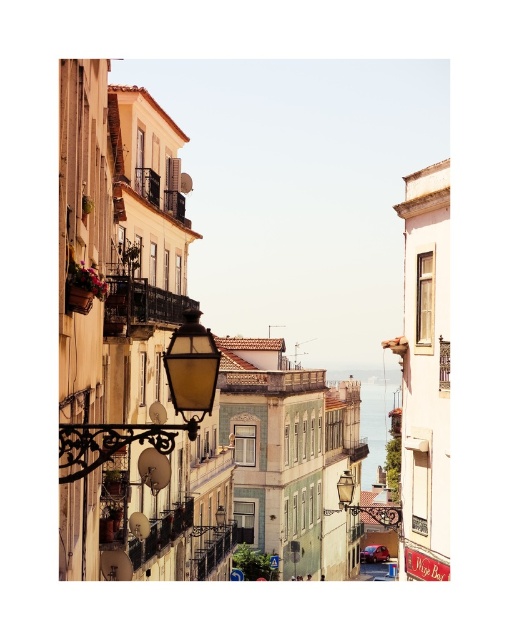
Is matte brass streetlamp at center-left behind clear blue water at center?

That is False.

Who is higher up, matte brass streetlamp at center-left or clear blue water at center?

matte brass streetlamp at center-left is higher up.

Is point (212, 374) positioned in front of point (388, 401)?

Yes, it is in front of point (388, 401).

The image size is (509, 640). What are the coordinates of `matte brass streetlamp at center-left` in the screenshot? It's located at (152, 419).

Is clear blue water at center to the left of matte black streetlamp at center from the viewer's perspective?

In fact, clear blue water at center is to the right of matte black streetlamp at center.

Can you confirm if clear blue water at center is positioned below matte black streetlamp at center?

Yes, clear blue water at center is below matte black streetlamp at center.

Is point (365, 474) positioned before point (379, 547)?

No, it is behind (379, 547).

Identify the location of clear blue water at center. (377, 419).

In the scene shown: Which of these two, matte brass streetlamp at center-left or rustic wrought iron balcony at center-left, stands shorter?

Standing shorter between the two is rustic wrought iron balcony at center-left.

Looking at this image, between matte brass streetlamp at center-left and rustic wrought iron balcony at center-left, which one is positioned lower?

matte brass streetlamp at center-left

Which is in front, point (86, 452) or point (119, 324)?

Positioned in front is point (86, 452).

You are a GUI agent. You are given a task and a screenshot of the screen. Output one action in this format:
    pyautogui.click(x=<x>, y=<y>)
    Task: Click on the matte brass streetlamp at center-left
    This screenshot has width=509, height=640.
    Given the screenshot: What is the action you would take?
    pyautogui.click(x=152, y=419)